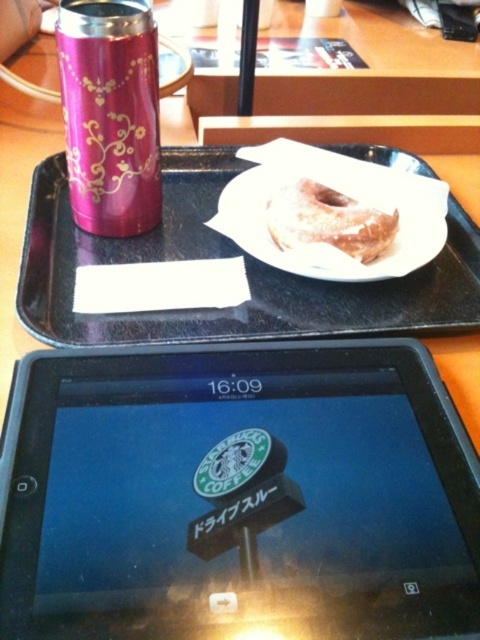
Question: Which point appears farthest from the camera in this image?

Choices:
 (A) (365, 426)
 (B) (74, 68)
 (C) (200, 163)

Answer: (C)

Question: From the image, what is the correct spatial relationship of black plastic tray at upper center in relation to white paper plate at center?

Choices:
 (A) below
 (B) above

Answer: (A)

Question: Does white paper plate at center have a smaller size compared to glazed sugar donut at center?

Choices:
 (A) no
 (B) yes

Answer: (A)

Question: Is metallic gold-patterned can at upper left below white paper plate at center?

Choices:
 (A) no
 (B) yes

Answer: (A)

Question: Based on their relative distances, which object is farther from the black plastic tablet at bottom?

Choices:
 (A) glazed sugar donut at center
 (B) black plastic tray at upper center
 (C) metallic gold-patterned can at upper left

Answer: (C)

Question: Considering the real-world distances, which object is farthest from the metallic gold-patterned can at upper left?

Choices:
 (A) glazed sugar donut at center
 (B) white paper plate at center

Answer: (A)